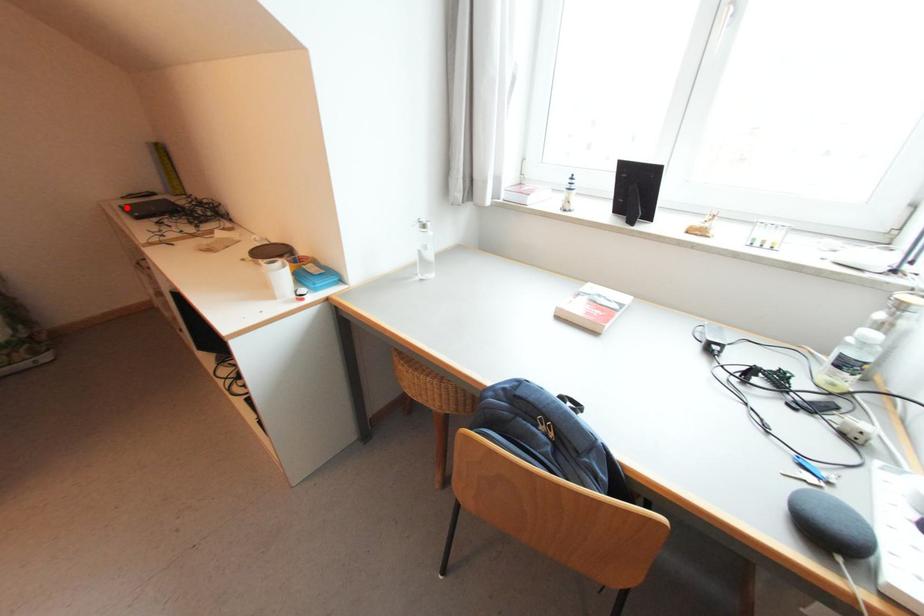
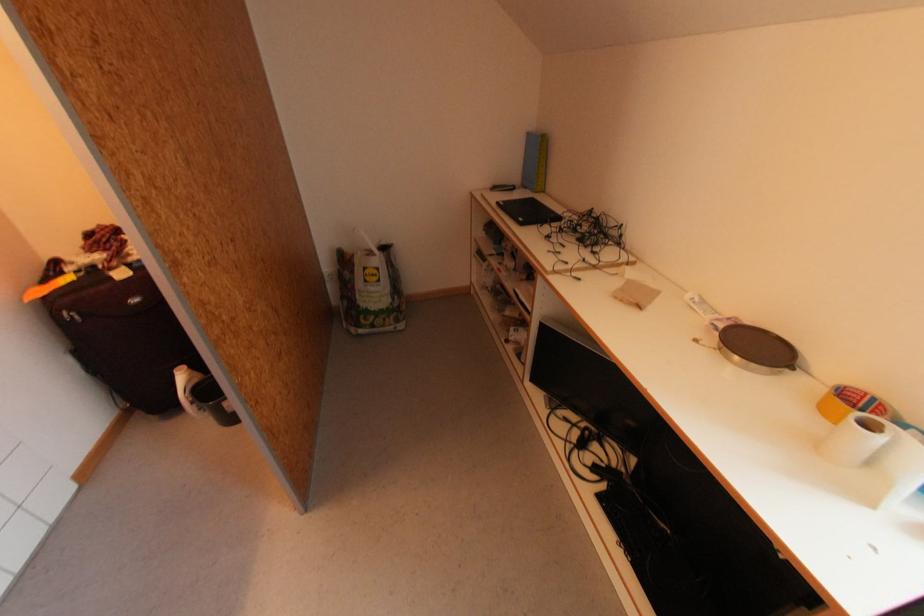
In the second image, find the point that corresponds to the highlighted location in the first image.

(503, 205)